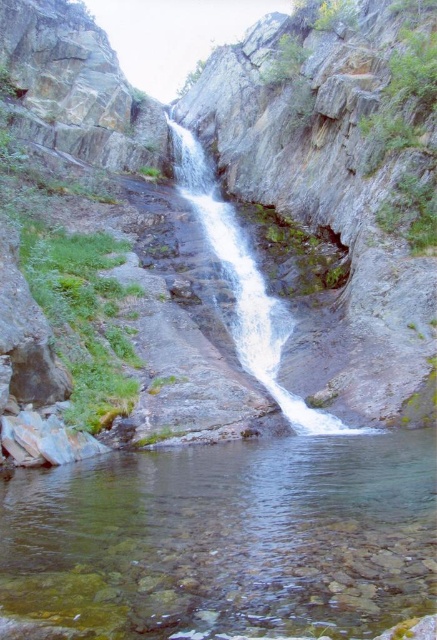
Question: Observing the image, what is the correct spatial positioning of clear glass water at center in reference to white frothy water at center?

Choices:
 (A) above
 (B) below

Answer: (B)

Question: Is clear glass water at center above white frothy water at center?

Choices:
 (A) no
 (B) yes

Answer: (A)

Question: Which point is farther to the camera?

Choices:
 (A) (201, 184)
 (B) (394, 470)

Answer: (A)

Question: Is clear glass water at center behind white frothy water at center?

Choices:
 (A) no
 (B) yes

Answer: (A)